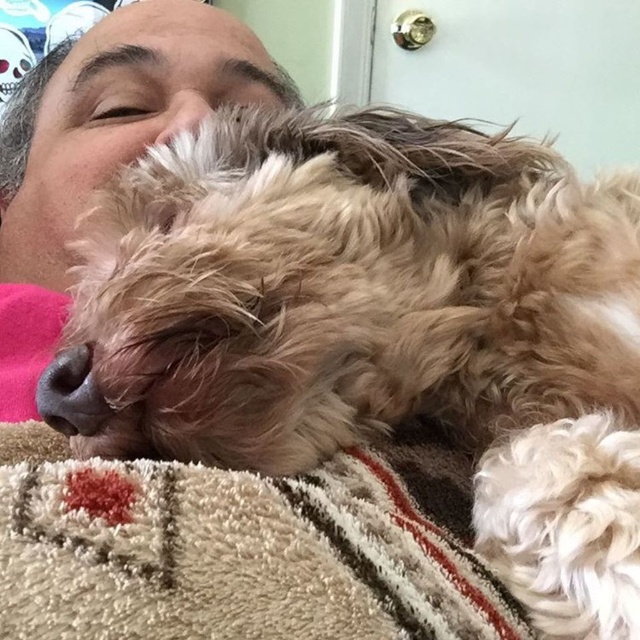
You are standing in the room shown in the image. There is a point at coordinates point (212,564). Can you reach that point with your hand without moving your feet?

The point at coordinates point (212,564) is 32.66 centimeters away from the viewer. Since this distance is within typical arm reach, you can likely reach it without moving your feet.

You are trying to find the white soft blanket at lower center in the image. According to the scene, where is it located relative to the matte pink fabric at left?

The white soft blanket at lower center is positioned under the matte pink fabric at left.

In the scene shown: You are trying to decide whether to place a small toy between the white soft blanket at lower center and the matte pink fabric at left. Based on their positions, which object should the toy be closer to if you want it near the front of the scene?

The white soft blanket at lower center is in front of the matte pink fabric at left, so placing the toy closer to the white soft blanket at lower center would position it near the front of the scene.